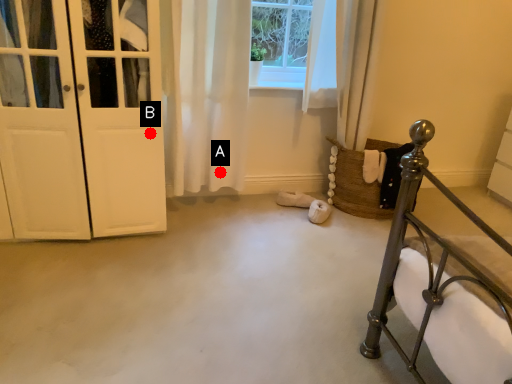
Question: Two points are circled on the image, labeled by A and B beside each circle. Which point is closer to the camera taking this photo?

Choices:
 (A) A is closer
 (B) B is closer

Answer: (B)